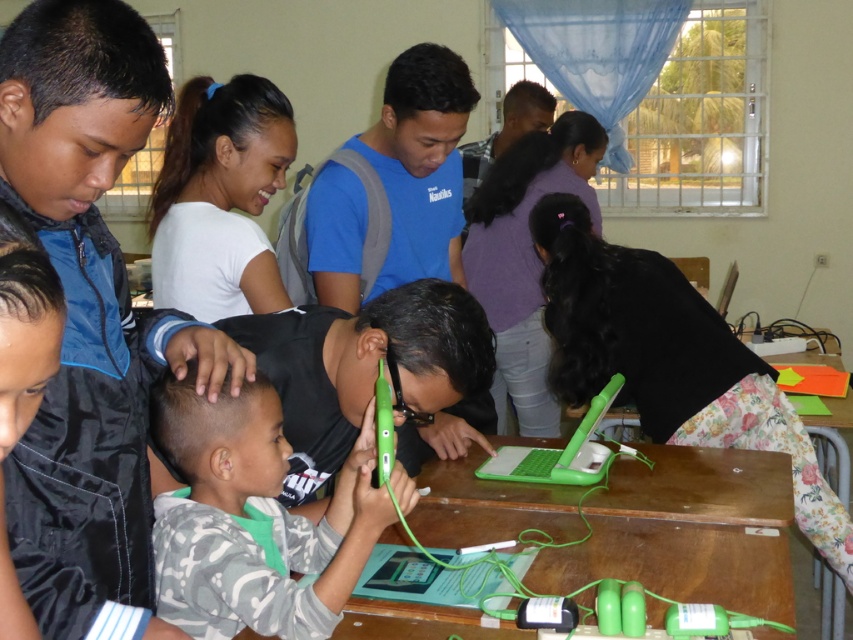
Looking at this image, which is above, green plastic table at center or green plastic phone at center?

green plastic phone at center is above.

Is green plastic table at center shorter than green plastic phone at center?

No, green plastic table at center is not shorter than green plastic phone at center.

Locate an element on the screen. This screenshot has height=640, width=853. green plastic table at center is located at coordinates (686, 531).

Is green plastic table at center taller than white matte shirt at upper center?

In fact, green plastic table at center may be shorter than white matte shirt at upper center.

Where is `green plastic table at center`? The height and width of the screenshot is (640, 853). green plastic table at center is located at coordinates (686, 531).

Does point (746, 464) come in front of point (199, 108)?

Yes, point (746, 464) is in front of point (199, 108).

Image resolution: width=853 pixels, height=640 pixels. What are the coordinates of `green plastic table at center` in the screenshot? It's located at (686, 531).

Is white matte shirt at upper center closer to the viewer compared to green plastic phone at center?

No, white matte shirt at upper center is further to the viewer.

Where is `white matte shirt at upper center`? white matte shirt at upper center is located at coordinates (219, 198).

Identify the location of white matte shirt at upper center. The image size is (853, 640). (219, 198).